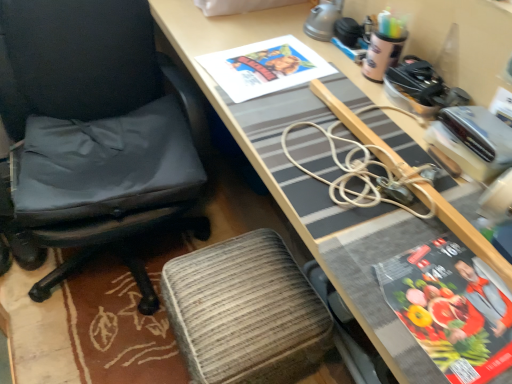
Question: Is matte paper magazine at right smaller than wooden desk at center?

Choices:
 (A) yes
 (B) no

Answer: (A)

Question: Is matte paper magazine at right turned away from wooden desk at center?

Choices:
 (A) yes
 (B) no

Answer: (A)

Question: Is matte paper magazine at right at the left side of wooden desk at center?

Choices:
 (A) no
 (B) yes

Answer: (A)

Question: Does matte paper magazine at right turn towards wooden desk at center?

Choices:
 (A) no
 (B) yes

Answer: (B)

Question: Does matte paper magazine at right have a larger size compared to wooden desk at center?

Choices:
 (A) yes
 (B) no

Answer: (B)

Question: Is matte paper magazine at right far away from wooden desk at center?

Choices:
 (A) yes
 (B) no

Answer: (B)

Question: Is matte paper book cover at upper center at the right side of textured fabric stool at lower center?

Choices:
 (A) yes
 (B) no

Answer: (A)

Question: Would you say matte paper book cover at upper center is outside textured fabric stool at lower center?

Choices:
 (A) yes
 (B) no

Answer: (A)

Question: Considering the relative sizes of matte paper book cover at upper center and textured fabric stool at lower center in the image provided, is matte paper book cover at upper center taller than textured fabric stool at lower center?

Choices:
 (A) yes
 (B) no

Answer: (B)

Question: Considering the relative sizes of matte paper book cover at upper center and textured fabric stool at lower center in the image provided, is matte paper book cover at upper center shorter than textured fabric stool at lower center?

Choices:
 (A) no
 (B) yes

Answer: (B)

Question: Is matte paper book cover at upper center thinner than textured fabric stool at lower center?

Choices:
 (A) yes
 (B) no

Answer: (A)

Question: Is matte paper book cover at upper center far away from textured fabric stool at lower center?

Choices:
 (A) yes
 (B) no

Answer: (B)

Question: Is textured fabric stool at lower center positioned far away from matte paper book cover at upper center?

Choices:
 (A) no
 (B) yes

Answer: (A)